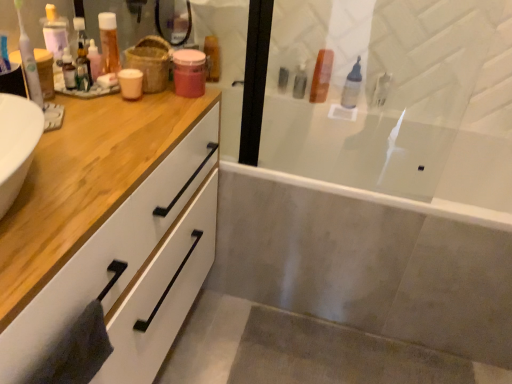
Question: Is burlap basket at upper center surrounding white glossy bathtub at center?

Choices:
 (A) no
 (B) yes

Answer: (A)

Question: Is burlap basket at upper center further to camera compared to white glossy bathtub at center?

Choices:
 (A) yes
 (B) no

Answer: (B)

Question: Considering the relative sizes of burlap basket at upper center and white glossy bathtub at center in the image provided, is burlap basket at upper center thinner than white glossy bathtub at center?

Choices:
 (A) yes
 (B) no

Answer: (A)

Question: Does burlap basket at upper center have a larger size compared to white glossy bathtub at center?

Choices:
 (A) yes
 (B) no

Answer: (B)

Question: From the image's perspective, is burlap basket at upper center on white glossy bathtub at center?

Choices:
 (A) no
 (B) yes

Answer: (B)

Question: Can you confirm if burlap basket at upper center is positioned to the left of white glossy bathtub at center?

Choices:
 (A) yes
 (B) no

Answer: (A)

Question: Considering the relative sizes of burlap basket at upper center and white plastic toothbrush at left in the image provided, is burlap basket at upper center wider than white plastic toothbrush at left?

Choices:
 (A) yes
 (B) no

Answer: (A)

Question: Is burlap basket at upper center placed right next to white plastic toothbrush at left?

Choices:
 (A) no
 (B) yes

Answer: (A)

Question: Is burlap basket at upper center closer to camera compared to white plastic toothbrush at left?

Choices:
 (A) yes
 (B) no

Answer: (B)

Question: Is the position of burlap basket at upper center more distant than that of white plastic toothbrush at left?

Choices:
 (A) no
 (B) yes

Answer: (B)

Question: Is burlap basket at upper center not inside white plastic toothbrush at left?

Choices:
 (A) no
 (B) yes

Answer: (B)

Question: Can you confirm if burlap basket at upper center is positioned to the left of white plastic toothbrush at left?

Choices:
 (A) no
 (B) yes

Answer: (A)

Question: Is white plastic toothbrush at left positioned with its back to translucent plastic bottle at upper left, which is the second toiletry from front to back?

Choices:
 (A) yes
 (B) no

Answer: (B)